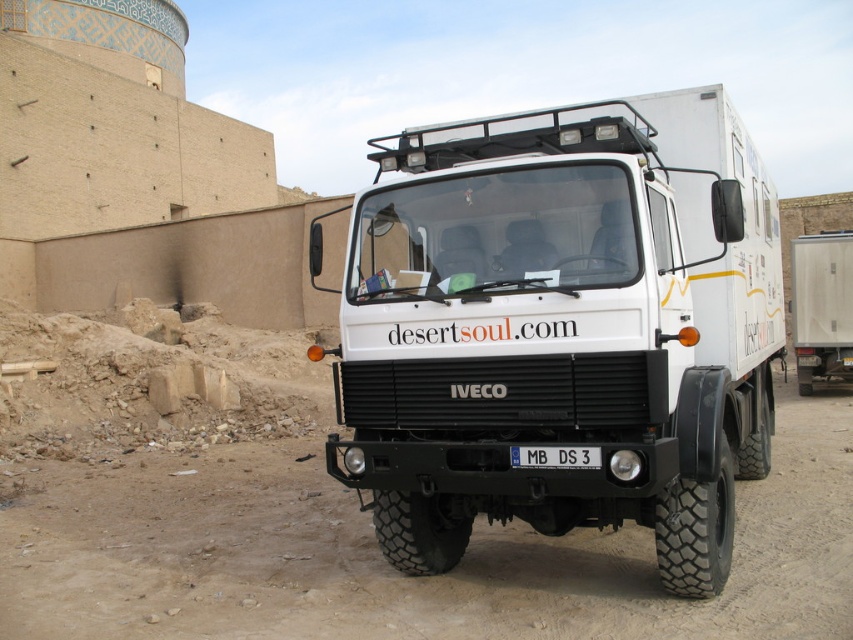
You are standing in front of the white Iveco truck parked in the desert. You see two points marked on the ground. The first point is at coordinate point (128, 618) and the second is at point (834, 326). Which point is closer to you?

The point at coordinate point (128, 618) is closer to you than the point at (834, 326).

You are standing 2 meters away from the white matte truck at center. If you walk straight towards it for 3 meters, will you reach the truck?

The white matte truck at center is 4.09 meters away from the viewer. If you walk 3 meters towards it, you will still be 1.09 meters away from the truck and won